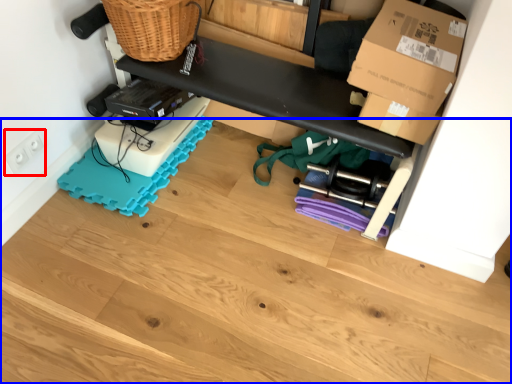
Question: Which object appears farthest to the camera in this image, electric outlet (highlighted by a red box) or wood (highlighted by a blue box)?

Choices:
 (A) electric outlet
 (B) wood

Answer: (A)